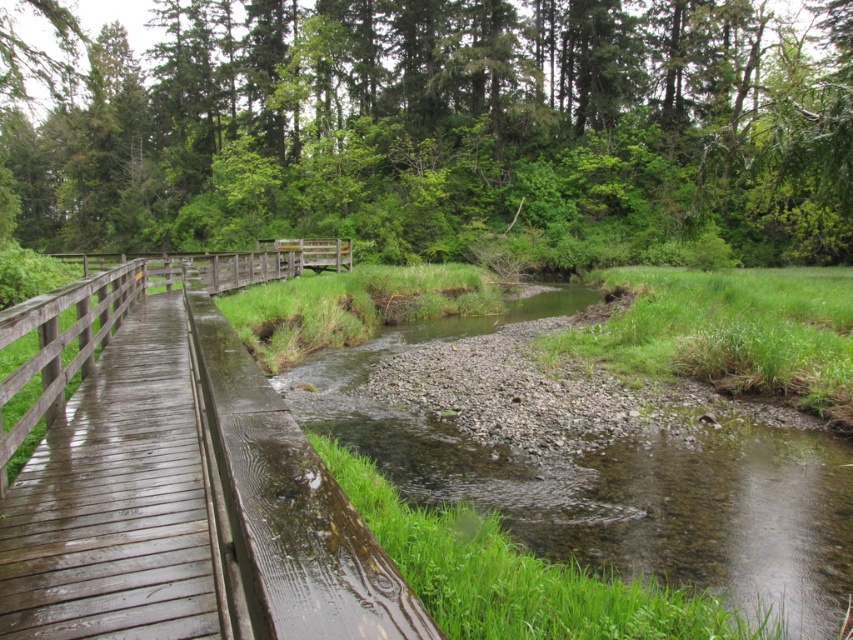
Question: Which is farther from the green leafy forest at upper center?

Choices:
 (A) wooden bridge at center
 (B) smooth gravel bed at center

Answer: (B)

Question: Considering the relative positions of green leafy forest at upper center and smooth gravel bed at center in the image provided, where is green leafy forest at upper center located with respect to smooth gravel bed at center?

Choices:
 (A) left
 (B) right

Answer: (A)

Question: Which of the following is the farthest from the observer?

Choices:
 (A) green leafy forest at upper center
 (B) smooth gravel bed at center

Answer: (A)

Question: Does smooth gravel bed at center appear on the right side of wooden bridge at center?

Choices:
 (A) yes
 (B) no

Answer: (A)

Question: Among these objects, which one is nearest to the camera?

Choices:
 (A) wooden bridge at center
 (B) smooth gravel bed at center
 (C) green leafy forest at upper center

Answer: (B)

Question: Is green leafy forest at upper center smaller than rustic wooden bridge at left?

Choices:
 (A) yes
 (B) no

Answer: (B)